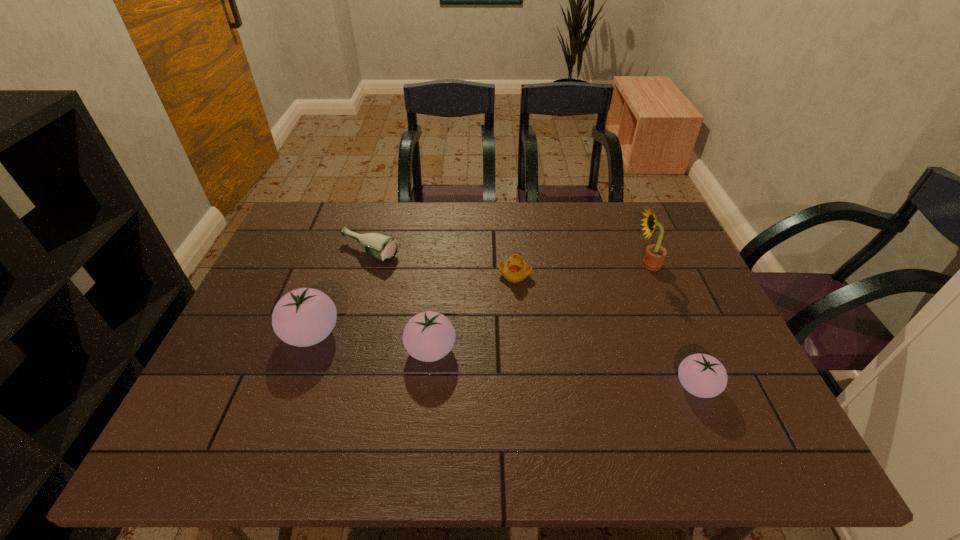
Locate an element on the screen. This screenshot has width=960, height=540. the tallest tomato is located at coordinates (303, 317).

Find the location of a particular element. The height and width of the screenshot is (540, 960). the fifth shortest object is located at coordinates (303, 317).

Image resolution: width=960 pixels, height=540 pixels. Identify the location of the second tomato from right to left. (428, 336).

In order to click on the fourth shortest object in this screenshot , I will do `click(428, 336)`.

I want to click on the fourth tallest object, so click(702, 375).

Find the location of a particular element. This screenshot has height=540, width=960. the shortest tomato is located at coordinates (702, 375).

Find the location of a particular element. Image resolution: width=960 pixels, height=540 pixels. the tallest object is located at coordinates (654, 256).

Locate an element on the screen. bottle is located at coordinates (383, 247).

The width and height of the screenshot is (960, 540). Find the location of `duckling`. duckling is located at coordinates (515, 270).

Image resolution: width=960 pixels, height=540 pixels. I want to click on vacant position located 0.150m on the front of the fifth shortest object, so click(282, 414).